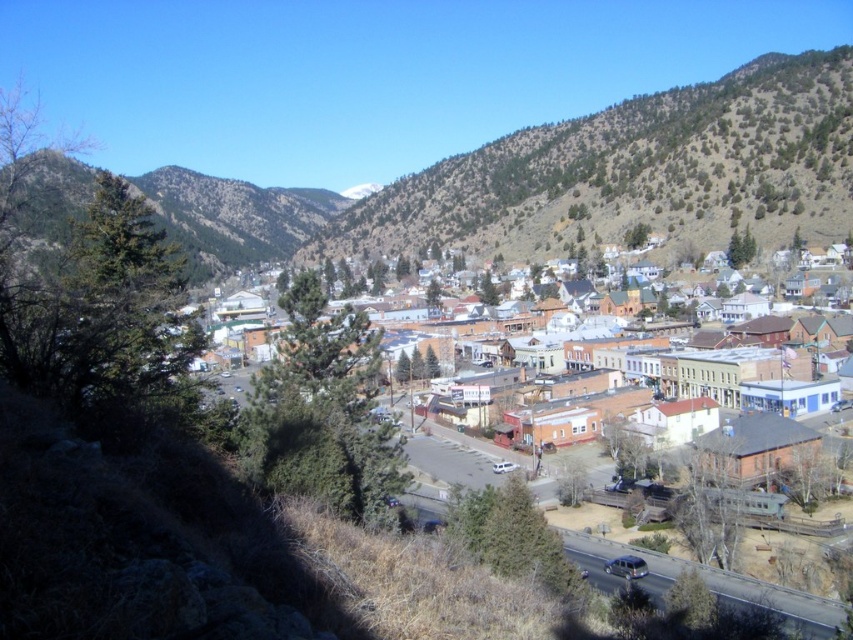
You are a delivery drone flying over the town. You need to deliver a package to the brown brick buildings at center. However, you notice the green leafy hillside at left in your path. Based on their positions, can you fly directly to the buildings without going around the hillside?

The green leafy hillside at left is located above the brown brick buildings at center. Since the hillside is above the buildings, the drone can fly under the hillside to reach the buildings directly without needing to go around.